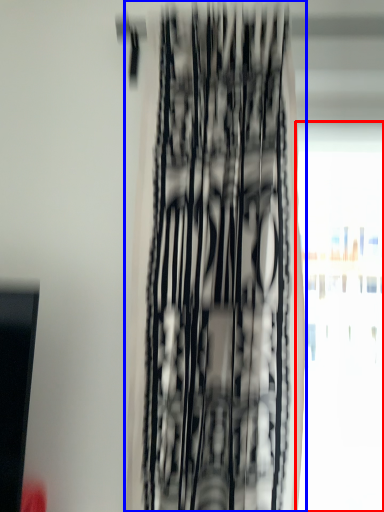
Question: Which object appears closest to the camera in this image, window (highlighted by a red box) or curtain (highlighted by a blue box)?

Choices:
 (A) window
 (B) curtain

Answer: (B)